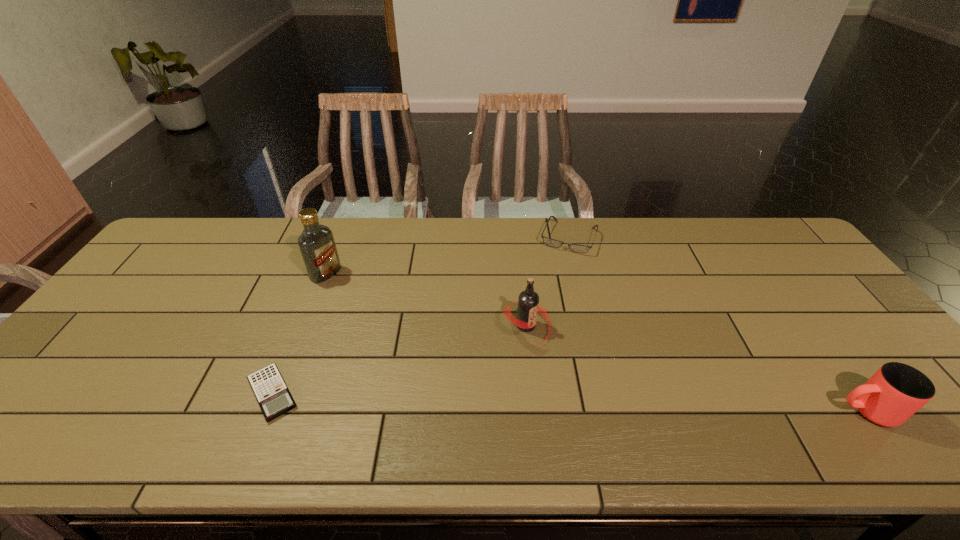
In the image, there is a desktop. Where is `vacant space at the right edge`? vacant space at the right edge is located at coordinates (800, 268).

The height and width of the screenshot is (540, 960). In the image, there is a desktop. In order to click on vacant space at the far left corner in this screenshot , I will do `click(166, 262)`.

At what (x,y) coordinates should I click in order to perform the action: click on vacant area at the far right corner of the desktop. Please return your answer as a coordinate pair (x, y). The width and height of the screenshot is (960, 540). Looking at the image, I should click on (799, 261).

Where is `empty location between the rightmost object and the third object from left to right`? This screenshot has width=960, height=540. empty location between the rightmost object and the third object from left to right is located at coordinates (696, 368).

At what (x,y) coordinates should I click in order to perform the action: click on free space between the calculator and the fourth tallest object. Please return your answer as a coordinate pair (x, y). This screenshot has width=960, height=540. Looking at the image, I should click on (420, 315).

At what (x,y) coordinates should I click in order to perform the action: click on free spot between the third shortest object and the fourth tallest object. Please return your answer as a coordinate pair (x, y). This screenshot has width=960, height=540. Looking at the image, I should click on (717, 324).

Where is `vacant space that is in between the farthest object and the third object from left to right`? The height and width of the screenshot is (540, 960). vacant space that is in between the farthest object and the third object from left to right is located at coordinates (547, 282).

Locate an element on the screen. The height and width of the screenshot is (540, 960). empty location between the calculator and the third farthest object is located at coordinates (399, 360).

Where is `vacant area that lies between the calculator and the fourth nearest object`? vacant area that lies between the calculator and the fourth nearest object is located at coordinates (300, 333).

Where is `blank region between the shortest object and the cup`? The image size is (960, 540). blank region between the shortest object and the cup is located at coordinates (569, 402).